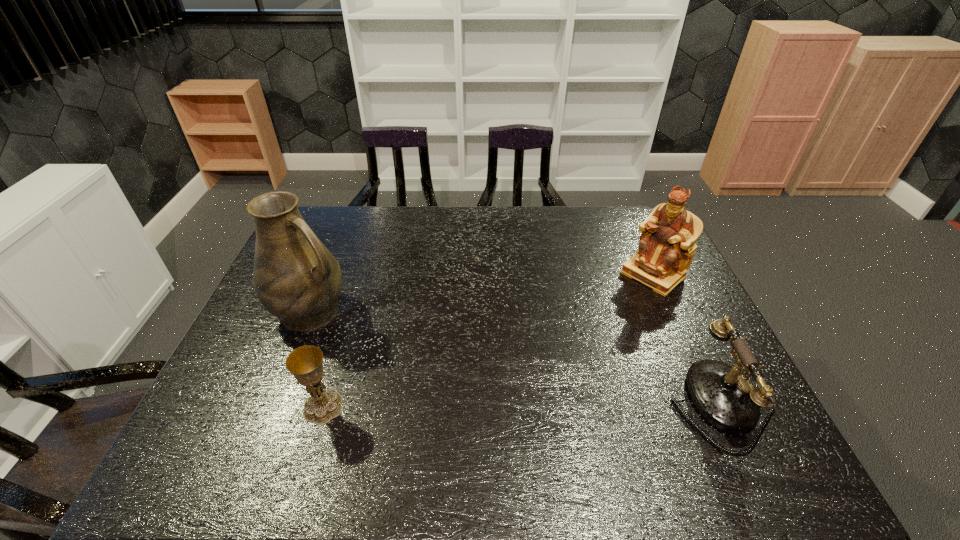
In order to click on vacant space at the far left corner in this screenshot , I will do `click(342, 221)`.

Locate an element on the screen. This screenshot has width=960, height=540. vacant space at the near left corner is located at coordinates (214, 409).

I want to click on vacant space at the far right corner, so click(x=616, y=230).

I want to click on empty space between the telephone and the figurine, so click(x=683, y=340).

Where is `free space between the second tallest object and the chalice`? free space between the second tallest object and the chalice is located at coordinates tap(488, 341).

Locate an element on the screen. This screenshot has width=960, height=540. free space between the tallest object and the telephone is located at coordinates (512, 358).

I want to click on vacant point located between the chalice and the figurine, so click(488, 341).

This screenshot has height=540, width=960. Find the location of `free space between the telephone and the tallest object`. free space between the telephone and the tallest object is located at coordinates (512, 358).

Find the location of a particular element. This screenshot has height=540, width=960. vacant space that is in between the telephone and the figurine is located at coordinates (683, 340).

The height and width of the screenshot is (540, 960). Find the location of `vacant region between the tallest object and the figurine`. vacant region between the tallest object and the figurine is located at coordinates (482, 293).